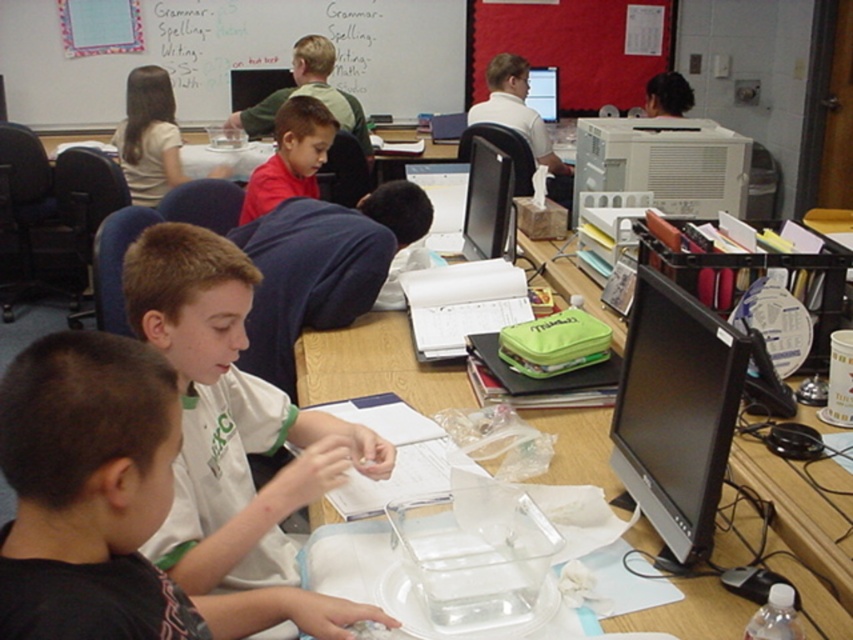
Question: Considering the relative positions of white cotton shirt at center and black glossy monitor at center in the image provided, where is white cotton shirt at center located with respect to black glossy monitor at center?

Choices:
 (A) above
 (B) below

Answer: (B)

Question: Which of these objects is positioned closest to the black glossy computer monitor at right?

Choices:
 (A) matte red shirt at center
 (B) black glossy computer monitor at center

Answer: (A)

Question: Which is farther from the black glossy monitor at center?

Choices:
 (A) black glossy computer monitor at center
 (B) white matte shirt at center
 (C) matte red shirt at center
 (D) black glossy computer monitor at right

Answer: (A)

Question: Which object appears farthest from the camera in this image?

Choices:
 (A) whiteboard at upper center
 (B) black glossy monitor at center
 (C) white cotton shirt at center

Answer: (A)

Question: Considering the relative positions of white matte shirt at center and matte red shirt at center in the image provided, where is white matte shirt at center located with respect to matte red shirt at center?

Choices:
 (A) left
 (B) right

Answer: (B)

Question: Considering the relative positions of white matte shirt at center and clear plastic tray at center in the image provided, where is white matte shirt at center located with respect to clear plastic tray at center?

Choices:
 (A) above
 (B) below

Answer: (B)